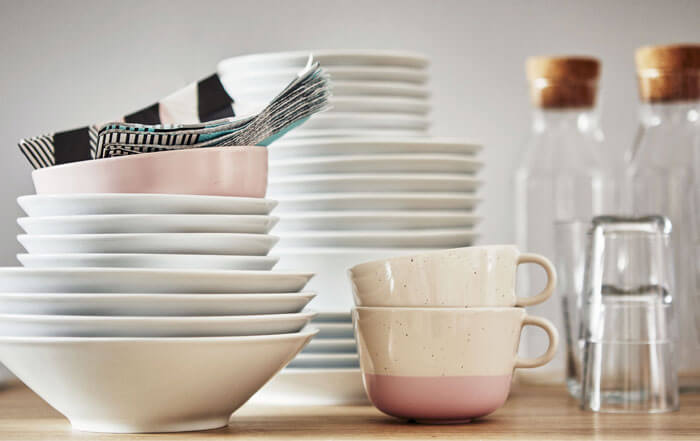
Where is `bowls`? This screenshot has height=441, width=700. bowls is located at coordinates (148, 200), (136, 219), (134, 240), (134, 269), (188, 278), (175, 302), (181, 322), (181, 356).